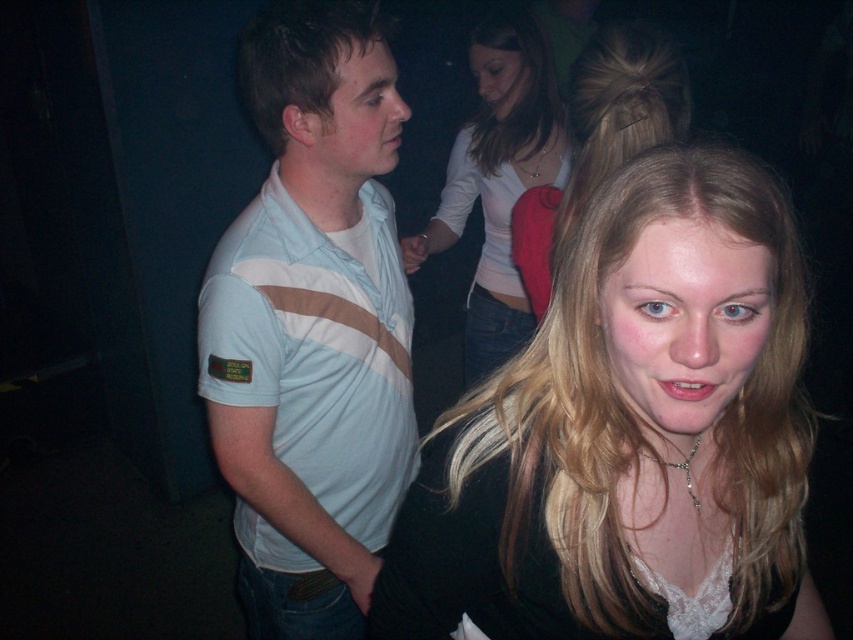
You are organizing a charity event and need to determine clothing sizes for donations. You have two shirts in front of you, the light blue striped polo shirt at center and the matte white shirt at upper left. Which shirt has a larger size?

The light blue striped polo shirt at center is bigger than the matte white shirt at upper left, so it has a larger size.